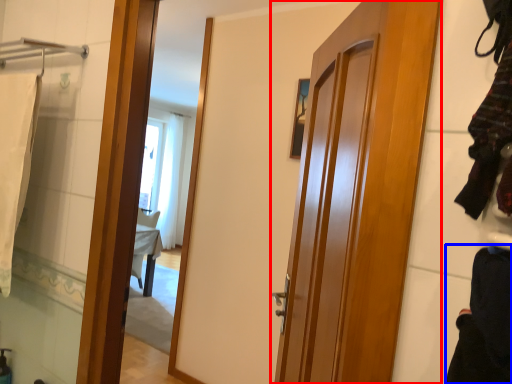
Question: Which object is closer to the camera taking this photo, door (highlighted by a red box) or clothing (highlighted by a blue box)?

Choices:
 (A) door
 (B) clothing

Answer: (B)